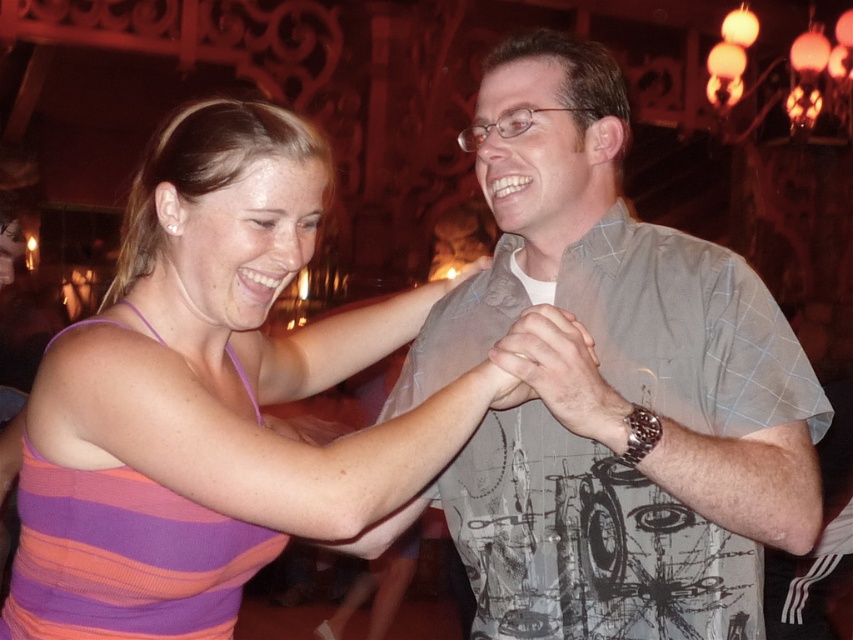
You are a photographer trying to capture a clear shot of both the gray checkered shirt at center and the striped tank top at center. Since you can only focus on one subject at a time, which one should you focus on to ensure the other is still somewhat in focus?

The striped tank top at center is behind the gray checkered shirt at center, so focusing on the gray checkered shirt at center will keep the striped tank top at center in better focus as they are at different distances.